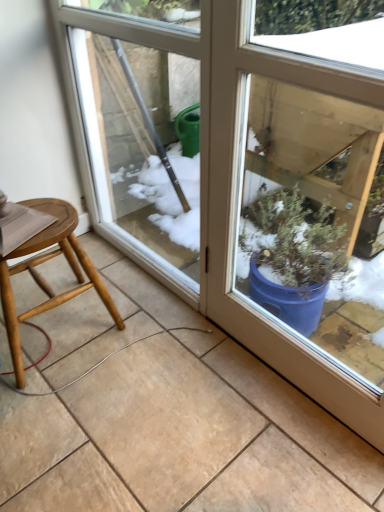
Locate an element on the screen. The width and height of the screenshot is (384, 512). free location above light wood stool at lower left (from a real-world perspective) is located at coordinates (41, 215).